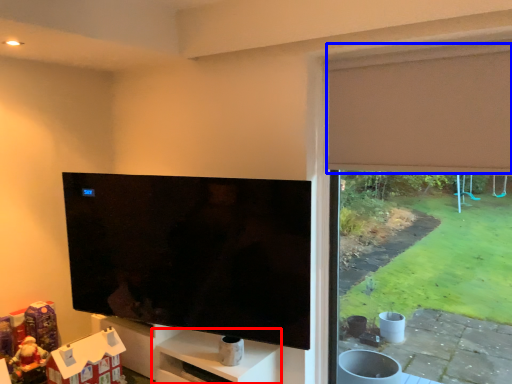
Question: Which point is closer to the camera, shelf (highlighted by a red box) or curtain (highlighted by a blue box)?

Choices:
 (A) shelf
 (B) curtain

Answer: (B)